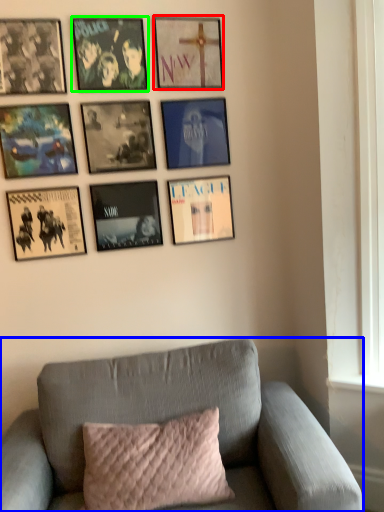
Question: Which is nearer to the picture frame (highlighted by a red box)? studio couch (highlighted by a blue box) or picture frame (highlighted by a green box).

Choices:
 (A) studio couch
 (B) picture frame

Answer: (B)